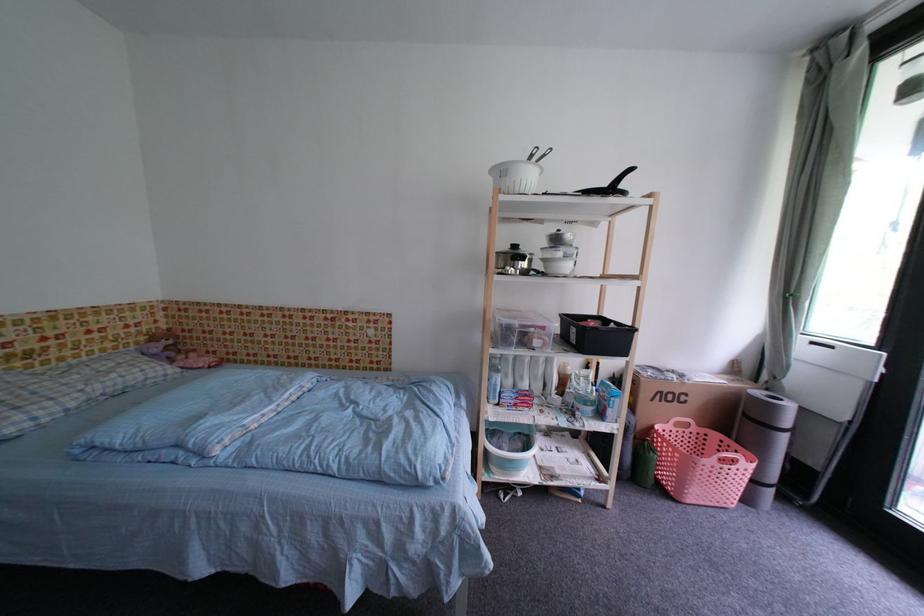
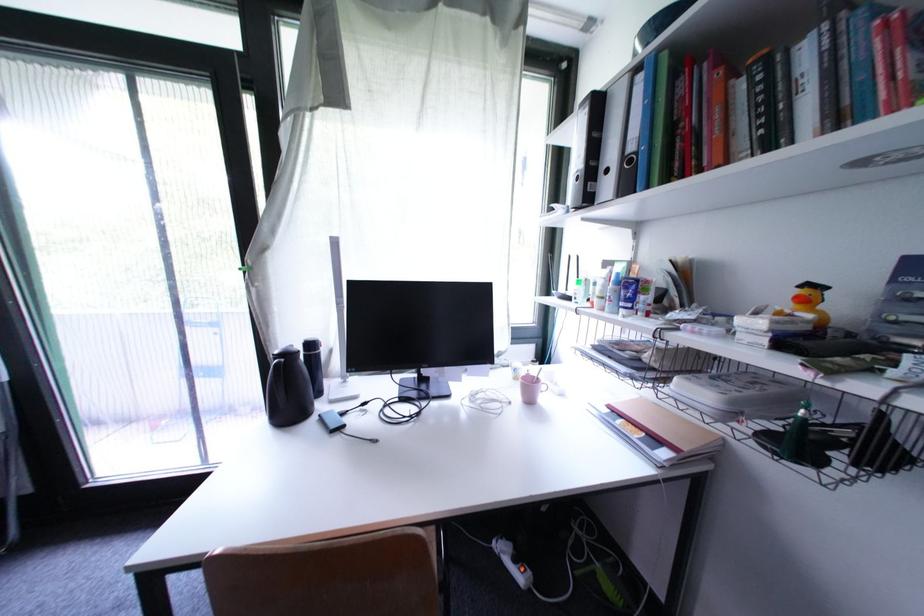
Question: The first image is from the beginning of the video and the second image is from the end. How did the camera likely rotate when shooting the video?

Choices:
 (A) Left
 (B) Right
 (C) Up
 (D) Down

Answer: (B)